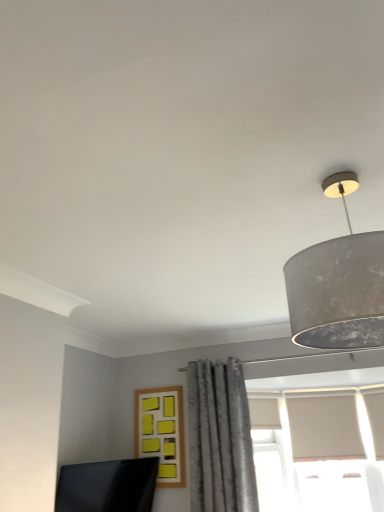
Question: Based on their sizes in the image, would you say yellow matte frame at center is bigger or smaller than matte black monitor at lower left?

Choices:
 (A) big
 (B) small

Answer: (B)

Question: Do you think yellow matte frame at center is within matte black monitor at lower left, or outside of it?

Choices:
 (A) inside
 (B) outside

Answer: (B)

Question: Estimate the real-world distances between objects in this image. Which object is farther from the matte gray lampshade at upper right?

Choices:
 (A) matte black monitor at lower left
 (B) gray textured curtain at center
 (C) yellow matte frame at center

Answer: (C)

Question: Based on their relative distances, which object is nearer to the yellow matte frame at center?

Choices:
 (A) gray textured curtain at center
 (B) matte black monitor at lower left
 (C) matte gray lampshade at upper right

Answer: (A)